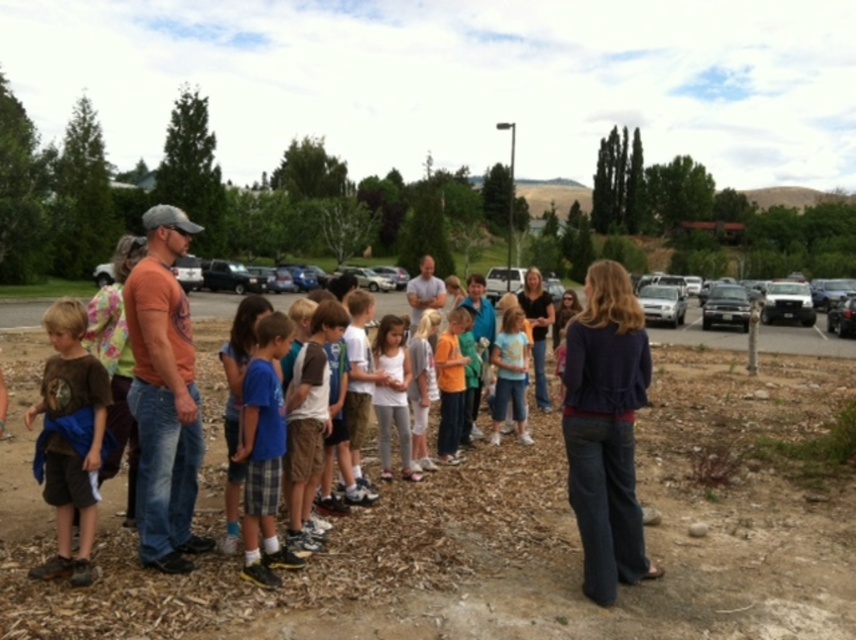
From the picture: You are a delivery person who needs to park a delivery van that is 2 meters wide. You see the silver metallic suv at right and the silver metallic sedan at center in the parking lot. Which parking spot can accommodate your van based on their widths?

The silver metallic suv at right has a larger width than the silver metallic sedan at center, so the parking spot where the silver metallic suv at right is parked can accommodate your 2 meter wide delivery van.

You are a photographer trying to capture a group photo of the blue plaid shorts at center and the metallic silver car at right. Since you want both subjects to appear similar in size in the photo, which object should you position closer to the camera?

The blue plaid shorts at center is narrower than the metallic silver car at right, so to make them appear similar in size in the photo, you should position the blue plaid shorts at center closer to the camera while keeping the metallic silver car at right farther away.

You are a photographer trying to capture a clear photo of the blue plaid shorts at center and the silver metallic sedan at center. However, you notice that one of the objects is blocking the view of the other. Which object is blocking the view of the other?

The blue plaid shorts at center is positioned under the silver metallic sedan at center, so the silver metallic sedan at center is blocking the view of the blue plaid shorts at center.